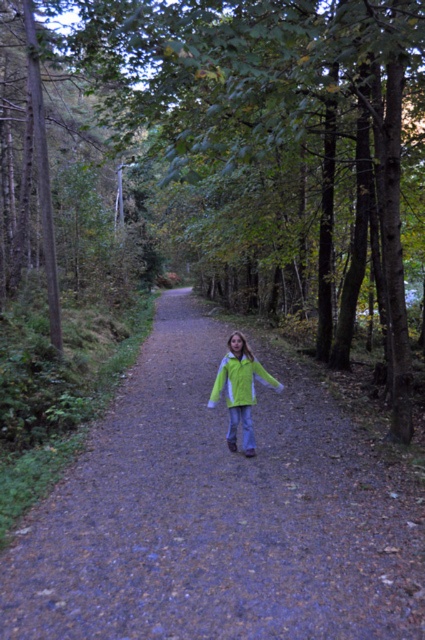
Question: Which of the following is the farthest from the observer?

Choices:
 (A) [240, 369]
 (B) [110, 444]

Answer: (B)

Question: Which point appears closest to the camera in this image?

Choices:
 (A) (232, 381)
 (B) (251, 378)
 (C) (329, 36)
 (D) (263, 605)

Answer: (D)

Question: Can you confirm if green matte jacket at center is thinner than neon green fabric jacket at center?

Choices:
 (A) yes
 (B) no

Answer: (A)

Question: Which of the following is the farthest from the observer?

Choices:
 (A) green matte jacket at center
 (B) green fabric jacket at center

Answer: (A)

Question: Considering the relative positions of dirt path at center and green matte jacket at center in the image provided, where is dirt path at center located with respect to green matte jacket at center?

Choices:
 (A) above
 (B) below

Answer: (B)

Question: Can you confirm if green fabric jacket at center is smaller than neon green fabric jacket at center?

Choices:
 (A) no
 (B) yes

Answer: (A)